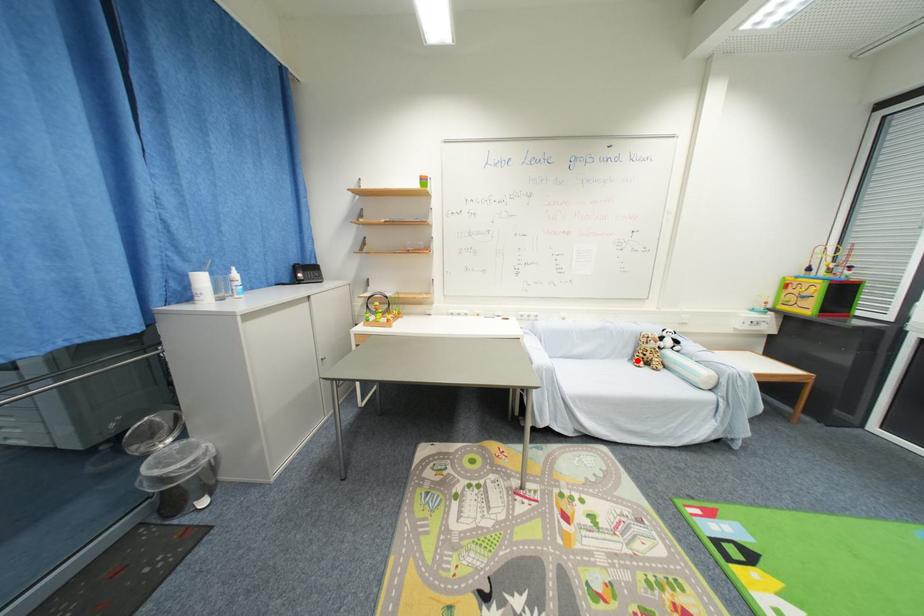
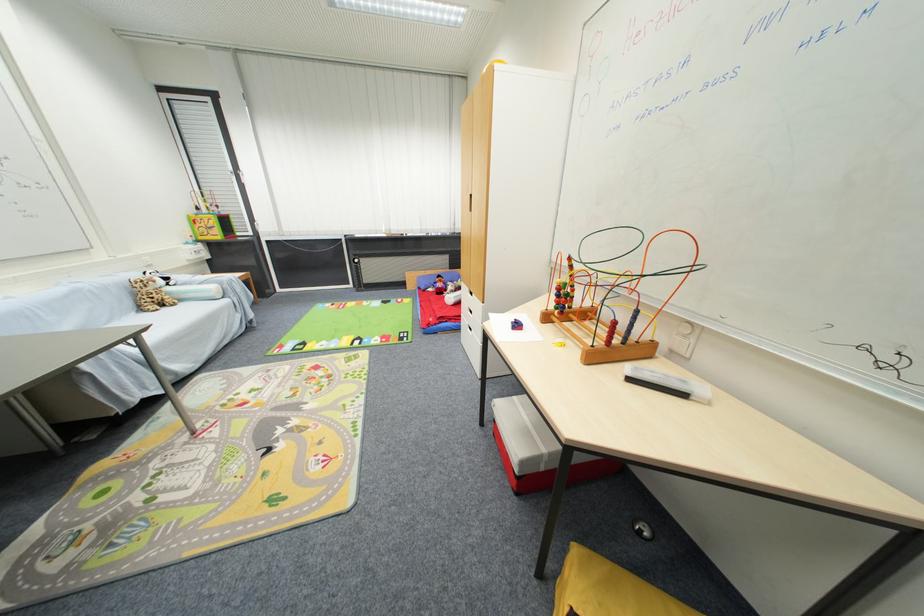
Where in the second image is the point corresponding to the highlighted location from the first image?

(146, 310)